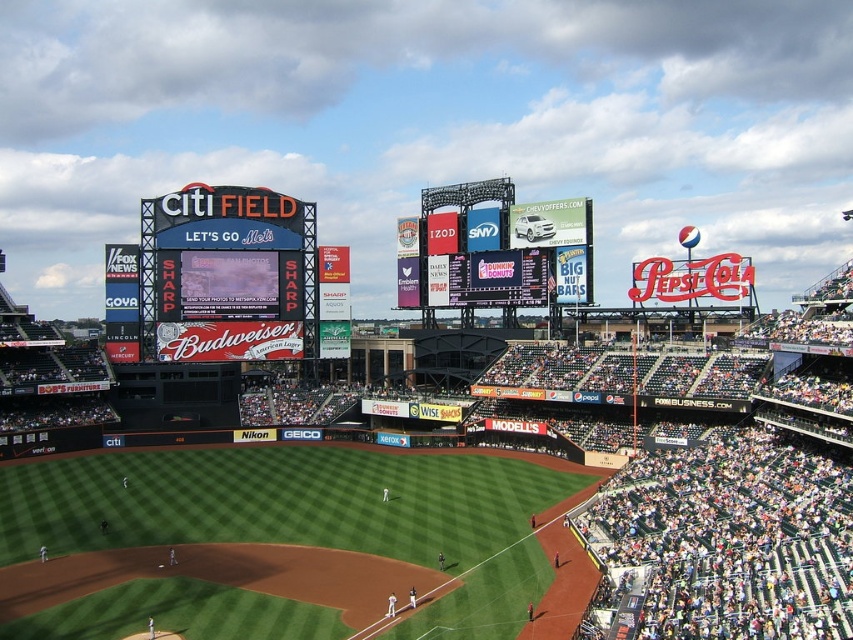
You are a drone operator flying a drone over Citi Field. Your drone is currently above the green grass at center and needs to navigate towards the matte black scoreboard at upper left. Which direction should you steer the drone to reach the scoreboard?

The green grass at center is positioned under the matte black scoreboard at upper left, so you should steer the drone upwards to reach the matte black scoreboard at upper left.

From the picture: You are a photographer at Citi Field and want to capture a wide shot of the playing field. Considering the green grass at center and the blue digital scoreboard at center, which object will occupy more space in your photo?

The green grass at center has a larger size compared to the blue digital scoreboard at center, so it will occupy more space in the photo.